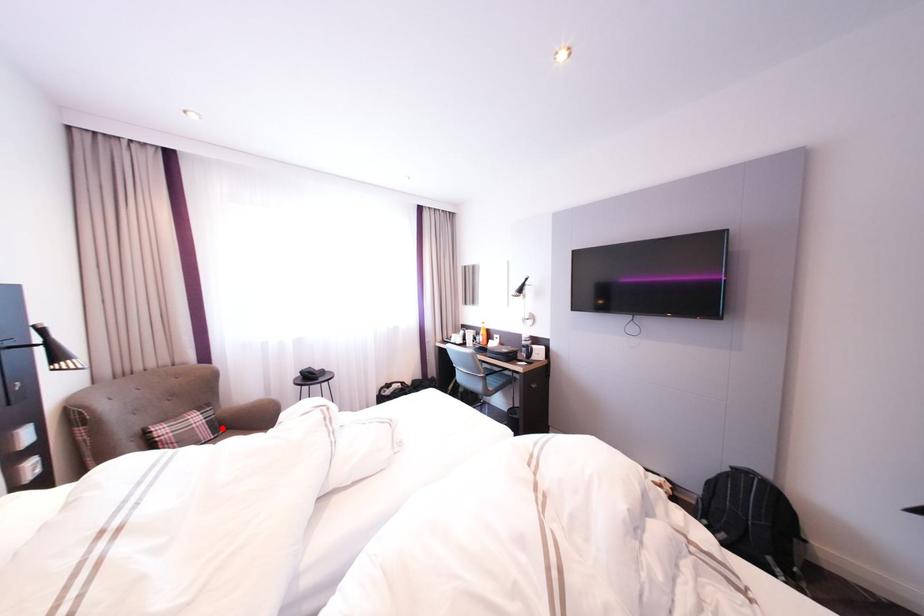
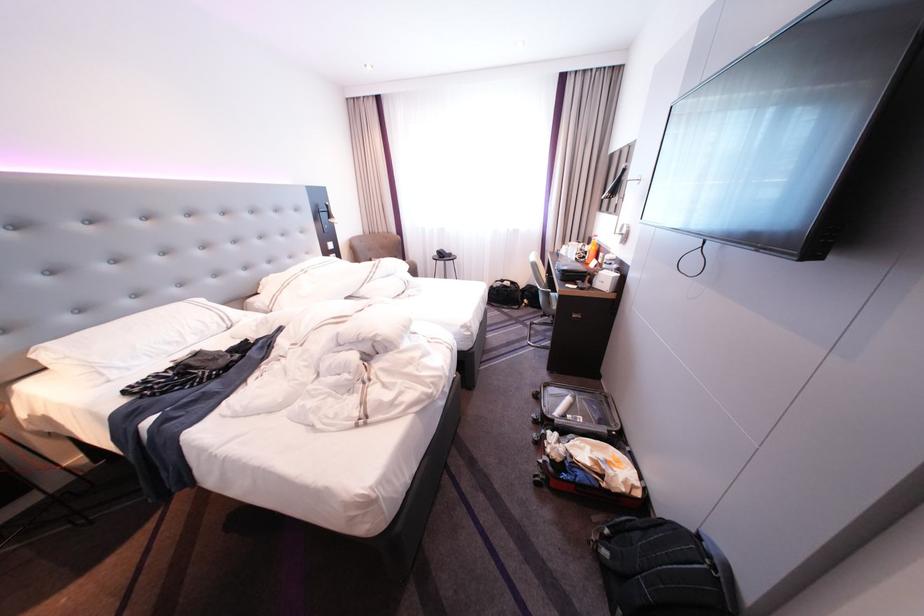
Question: I am providing you with two images of the same scene from different viewpoints. A red point is marked on the first image. Is the red point's position out of view in image 2?

Choices:
 (A) Yes
 (B) No

Answer: (A)